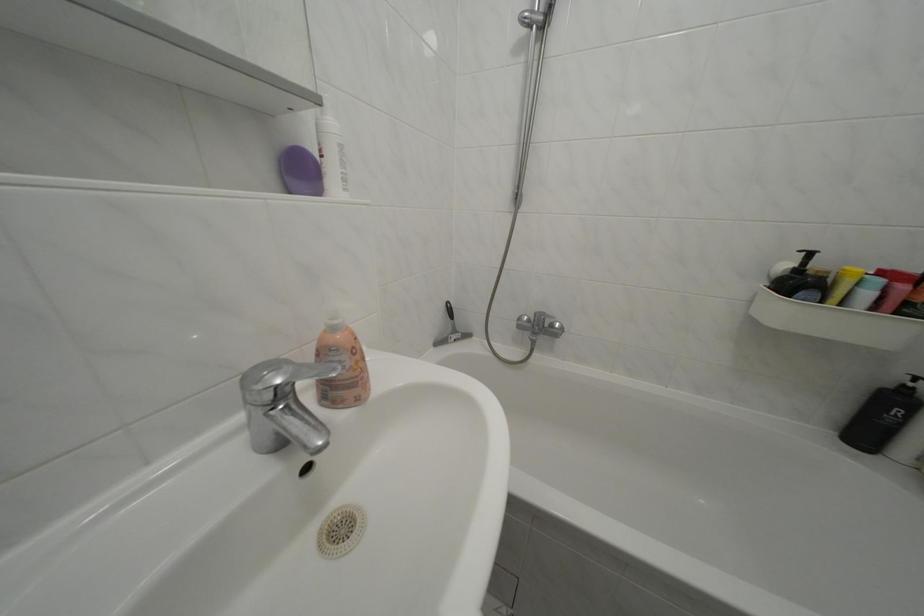
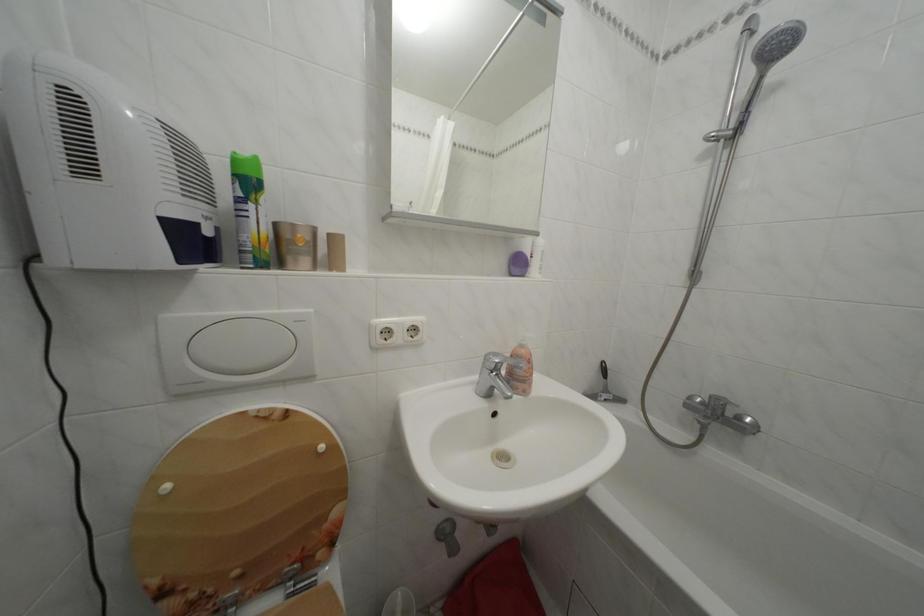
Find the pixel in the second image that matches pixel 342 334 in the first image.

(530, 352)